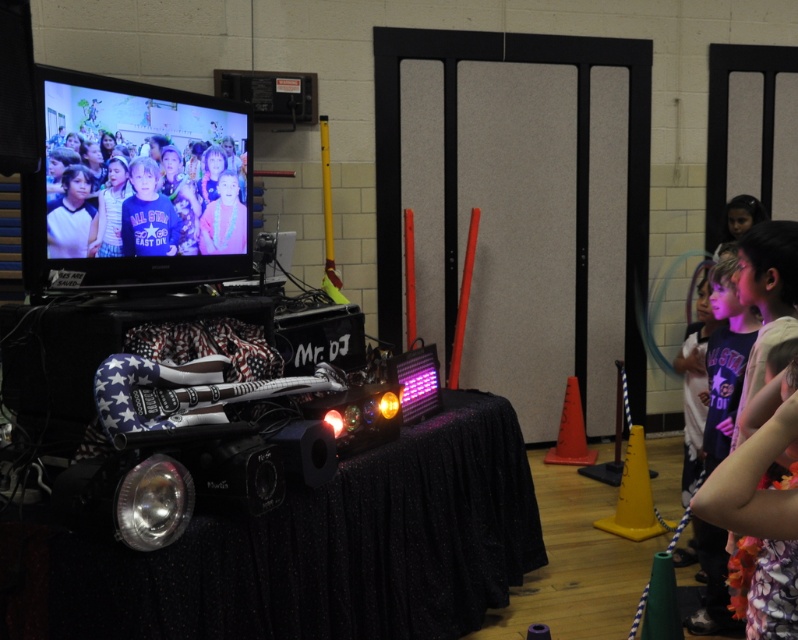
Between matte black shirt at upper left and floral dress at right, which one has less height?

matte black shirt at upper left is shorter.

How much distance is there between matte black shirt at upper left and floral dress at right?

1.75 meters

Does point (194, 250) come farther from viewer compared to point (745, 280)?

Yes, it is behind point (745, 280).

This screenshot has height=640, width=798. I want to click on matte black shirt at upper left, so click(x=156, y=211).